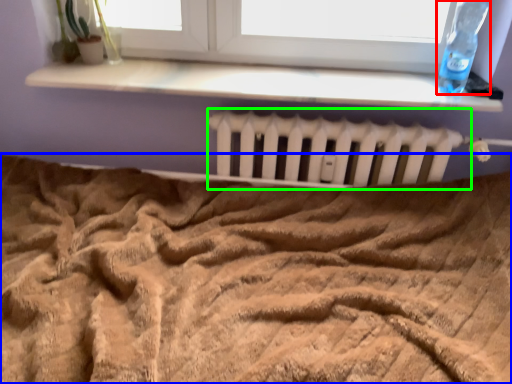
Question: Considering the real-world distances, which object is farthest from bottle (highlighted by a red box)? bed (highlighted by a blue box) or radiator (highlighted by a green box)?

Choices:
 (A) bed
 (B) radiator

Answer: (A)